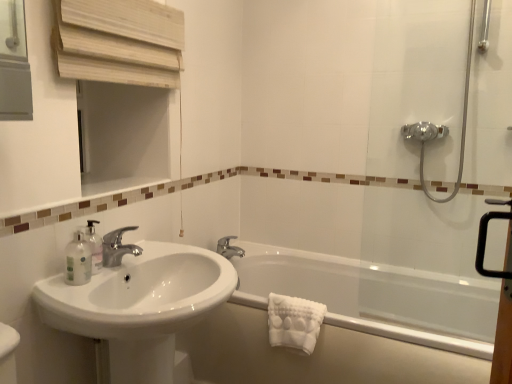
The width and height of the screenshot is (512, 384). Describe the element at coordinates (118, 247) in the screenshot. I see `polished chrome faucet at center, acting as the first tap starting from the front` at that location.

At what (x,y) coordinates should I click in order to perform the action: click on wooden medicine cabinet at upper left. Please return your answer as a coordinate pair (x, y). Looking at the image, I should click on (119, 41).

The height and width of the screenshot is (384, 512). What do you see at coordinates (294, 322) in the screenshot?
I see `white textured towel at lower right` at bounding box center [294, 322].

Find the location of a particular element. The image size is (512, 384). translucent plastic bottles at left is located at coordinates [78, 260].

Image resolution: width=512 pixels, height=384 pixels. Find the location of `silver metallic faucet at upper center, which is counted as the 2th tap, starting from the front`. silver metallic faucet at upper center, which is counted as the 2th tap, starting from the front is located at coordinates (229, 248).

Which object is more forward, white glossy sink at lower left or white textured towel at lower right?

white glossy sink at lower left.

Is white glossy sink at lower left thinner than white textured towel at lower right?

No.

Is white textured towel at lower right a part of white glossy sink at lower left?

No, white textured towel at lower right is located outside of white glossy sink at lower left.

Between translucent plastic bottles at left and white glossy bathtub at lower right, which one has smaller size?

translucent plastic bottles at left is smaller.

Is translucent plastic bottles at left located outside white glossy bathtub at lower right?

Absolutely, translucent plastic bottles at left is external to white glossy bathtub at lower right.

Which is behind, translucent plastic bottles at left or white glossy bathtub at lower right?

white glossy bathtub at lower right is further from the camera.

Which object is wider, translucent plastic bottles at left or white glossy bathtub at lower right?

Wider between the two is white glossy bathtub at lower right.

From a real-world perspective, does white glossy sink at lower left stand above silver metallic faucet at upper center, which appears as the 2th tap when viewed from the left?

Incorrect, from a real-world perspective, white glossy sink at lower left is lower than silver metallic faucet at upper center, which appears as the 2th tap when viewed from the left.

Is white glossy sink at lower left shorter than silver metallic faucet at upper center, placed as the 1th tap when sorted from back to front?

No, white glossy sink at lower left is not shorter than silver metallic faucet at upper center, placed as the 1th tap when sorted from back to front.

Is white glossy sink at lower left looking in the opposite direction of silver metallic faucet at upper center, placed as the 1th tap when sorted from back to front?

No, silver metallic faucet at upper center, placed as the 1th tap when sorted from back to front, is not at the back of white glossy sink at lower left.

Is wooden medicine cabinet at upper left looking in the opposite direction of polished chrome faucet at center, acting as the 2th tap starting from the back?

That's not correct — wooden medicine cabinet at upper left is not looking away from polished chrome faucet at center, acting as the 2th tap starting from the back.

Is wooden medicine cabinet at upper left surrounding polished chrome faucet at center, the first tap positioned from the left?

That's incorrect, polished chrome faucet at center, the first tap positioned from the left, is not inside wooden medicine cabinet at upper left.

Considering the sizes of transparent glass shower door at right and white glossy bathtub at lower right in the image, is transparent glass shower door at right taller or shorter than white glossy bathtub at lower right?

In the image, transparent glass shower door at right appears to be taller than white glossy bathtub at lower right.

From a real-world perspective, is transparent glass shower door at right physically located above or below white glossy bathtub at lower right?

In terms of real-world spatial position, transparent glass shower door at right is above white glossy bathtub at lower right.

From the image's perspective, is transparent glass shower door at right positioned above or below white glossy bathtub at lower right?

Based on their image positions, transparent glass shower door at right is located above white glossy bathtub at lower right.

Does transparent glass shower door at right have a lesser width compared to white glossy bathtub at lower right?

Indeed, transparent glass shower door at right has a lesser width compared to white glossy bathtub at lower right.

From the picture: Does white glossy bathtub at lower right appear on the right side of translucent plastic bottles at left?

Correct, you'll find white glossy bathtub at lower right to the right of translucent plastic bottles at left.

Based on the photo, is white glossy bathtub at lower right not close to translucent plastic bottles at left?

Indeed, white glossy bathtub at lower right is not near translucent plastic bottles at left.

Is white glossy bathtub at lower right inside or outside of translucent plastic bottles at left?

The correct answer is: outside.

How many degrees apart are the facing directions of silver metallic faucet at upper center, placed as the 1th tap when sorted from back to front, and polished chrome faucet at center, the first tap positioned from the left?

silver metallic faucet at upper center, placed as the 1th tap when sorted from back to front, and polished chrome faucet at center, the first tap positioned from the left, are facing 2.05 degrees away from each other.

Would you say polished chrome faucet at center, the first tap positioned from the left, is part of silver metallic faucet at upper center, which is the 1th tap in right-to-left order,'s contents?

No, polished chrome faucet at center, the first tap positioned from the left, is not surrounded by silver metallic faucet at upper center, which is the 1th tap in right-to-left order.

Measure the distance between silver metallic faucet at upper center, placed as the 1th tap when sorted from back to front, and polished chrome faucet at center, which is the second tap from right to left.

silver metallic faucet at upper center, placed as the 1th tap when sorted from back to front, is 31.14 inches from polished chrome faucet at center, which is the second tap from right to left.

Is silver metallic faucet at upper center, which is the 1th tap in right-to-left order, facing away from polished chrome faucet at center, which is the second tap from right to left?

No, silver metallic faucet at upper center, which is the 1th tap in right-to-left order, is not facing the opposite direction of polished chrome faucet at center, which is the second tap from right to left.

At what (x,y) coordinates should I click in order to perform the action: click on sink below the white textured towel at lower right (from a real-world perspective). Please return your answer as a coordinate pair (x, y). The width and height of the screenshot is (512, 384). Looking at the image, I should click on (138, 305).

Identify the location of toiletry in front of the white glossy bathtub at lower right. [78, 260].

Looking at the image, which one is located closer to transparent glass shower door at right, white textured towel at lower right or white glossy bathtub at lower right?

white glossy bathtub at lower right lies closer to transparent glass shower door at right than the other object.

Considering their positions, is white glossy sink at lower left positioned closer to white textured towel at lower right than wooden medicine cabinet at upper left?

white glossy sink at lower left is closer to white textured towel at lower right.

From the image, which object appears to be farther from white glossy sink at lower left, white glossy bathtub at lower right or silver metallic faucet at upper center, which is counted as the 2th tap, starting from the front?

Among the two, white glossy bathtub at lower right is located further to white glossy sink at lower left.

Which object lies further to the anchor point translucent plastic bottles at left, silver metallic faucet at upper center, which appears as the 2th tap when viewed from the left, or transparent plastic soap dispenser at left?

Among the two, silver metallic faucet at upper center, which appears as the 2th tap when viewed from the left, is located further to translucent plastic bottles at left.

In the scene shown: Which object lies further to the anchor point white textured towel at lower right, white glossy sink at lower left or white glossy bathtub at lower right?

white glossy bathtub at lower right is positioned further to the anchor white textured towel at lower right.

Estimate the real-world distances between objects in this image. Which object is closer to silver metallic faucet at upper center, which is the 1th tap in right-to-left order, white textured towel at lower right or polished chrome faucet at center, which is the second tap from right to left?

Among the two, white textured towel at lower right is located nearer to silver metallic faucet at upper center, which is the 1th tap in right-to-left order.

Based on their spatial positions, is transparent plastic soap dispenser at left or white glossy bathtub at lower right further from wooden medicine cabinet at upper left?

white glossy bathtub at lower right is further to wooden medicine cabinet at upper left.

Looking at this image, looking at the image, which one is located further to white textured towel at lower right, translucent plastic bottles at left or transparent plastic soap dispenser at left?

Based on the image, translucent plastic bottles at left appears to be further to white textured towel at lower right.

I want to click on tap between white glossy bathtub at lower right and silver metallic faucet at upper center, which appears as the 2th tap when viewed from the left, from front to back, so click(118, 247).

This screenshot has height=384, width=512. Identify the location of soap dispenser between wooden medicine cabinet at upper left and white glossy sink at lower left in the vertical direction. (94, 246).

Where is `toiletry located between wooden medicine cabinet at upper left and silver metallic faucet at upper center, which is counted as the 2th tap, starting from the front, in the depth direction`? The width and height of the screenshot is (512, 384). toiletry located between wooden medicine cabinet at upper left and silver metallic faucet at upper center, which is counted as the 2th tap, starting from the front, in the depth direction is located at coordinates (78, 260).

Locate an element on the screen. Image resolution: width=512 pixels, height=384 pixels. toiletry between polished chrome faucet at center, acting as the 2th tap starting from the back, and white glossy sink at lower left, in the vertical direction is located at coordinates (78, 260).